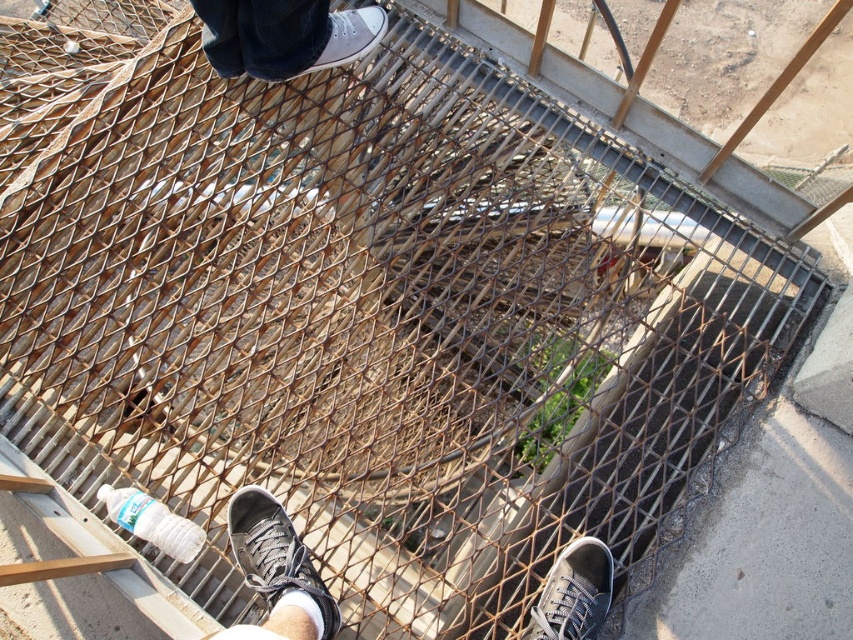
Does point (564, 636) lie in front of point (338, 61)?

Yes, it is.

Is point (581, 600) positioned behind point (323, 67)?

No, it is not.

Locate an element on the screen. This screenshot has height=640, width=853. matte gray sneaker at lower right is located at coordinates [573, 593].

Which is more to the left, matte gray sneaker at lower center or matte gray canvas shoe at upper center?

From the viewer's perspective, matte gray sneaker at lower center appears more on the left side.

Can you confirm if matte gray sneaker at lower center is smaller than matte gray canvas shoe at upper center?

No.

What do you see at coordinates (276, 554) in the screenshot?
I see `matte gray sneaker at lower center` at bounding box center [276, 554].

At what (x,y) coordinates should I click in order to perform the action: click on matte gray sneaker at lower center. Please return your answer as a coordinate pair (x, y). This screenshot has height=640, width=853. Looking at the image, I should click on (276, 554).

Consider the image. Which of these two, matte gray sneaker at lower center or matte gray sneaker at lower right, stands taller?

matte gray sneaker at lower center

Is matte gray sneaker at lower center thinner than matte gray sneaker at lower right?

Incorrect, matte gray sneaker at lower center's width is not less than matte gray sneaker at lower right's.

You are a GUI agent. You are given a task and a screenshot of the screen. Output one action in this format:
    pyautogui.click(x=<x>, y=<y>)
    Task: Click on the matte gray sneaker at lower center
    The image size is (853, 640).
    Given the screenshot: What is the action you would take?
    pyautogui.click(x=276, y=554)

The width and height of the screenshot is (853, 640). What are the coordinates of `matte gray sneaker at lower center` in the screenshot? It's located at (276, 554).